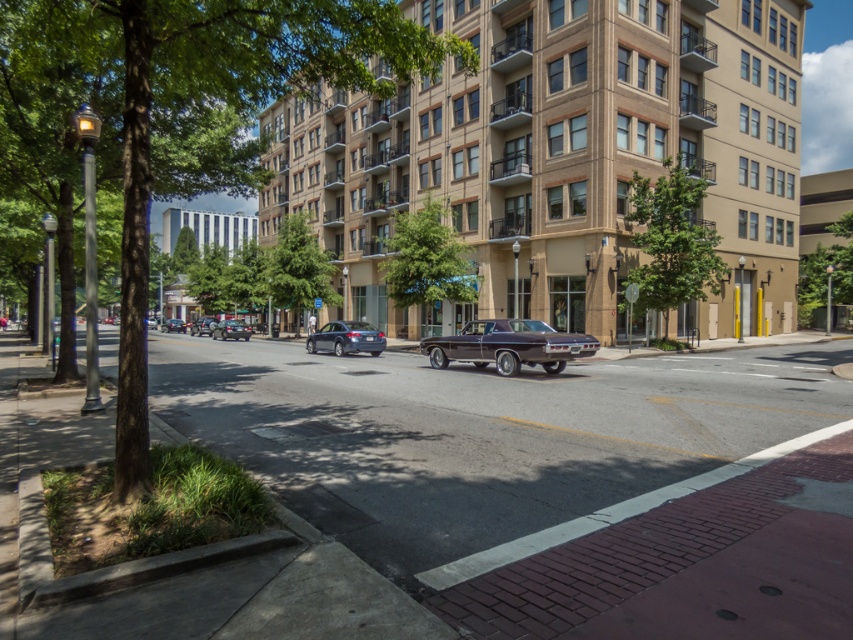
Question: Which is nearer to the shiny black sedan at center?

Choices:
 (A) shiny brown car at center
 (B) shiny silver sedan at center-left
 (C) shiny black sedan at center-left

Answer: (B)

Question: Which object is closer to the camera taking this photo?

Choices:
 (A) shiny brown car at center
 (B) shiny black sedan at center-left
 (C) shiny blue sedan at center

Answer: (A)

Question: Observing the image, what is the correct spatial positioning of shiny blue sedan at center in reference to shiny black sedan at center-left?

Choices:
 (A) above
 (B) below

Answer: (B)

Question: Considering the real-world distances, which object is farthest from the shiny black sedan at center-left?

Choices:
 (A) shiny brown car at center
 (B) shiny silver sedan at center-left
 (C) shiny blue sedan at center

Answer: (A)

Question: Where is shiny silver sedan at center-left located in relation to shiny black sedan at center-left in the image?

Choices:
 (A) right
 (B) left

Answer: (A)

Question: Does shiny brown car at center appear under shiny black sedan at center?

Choices:
 (A) no
 (B) yes

Answer: (B)